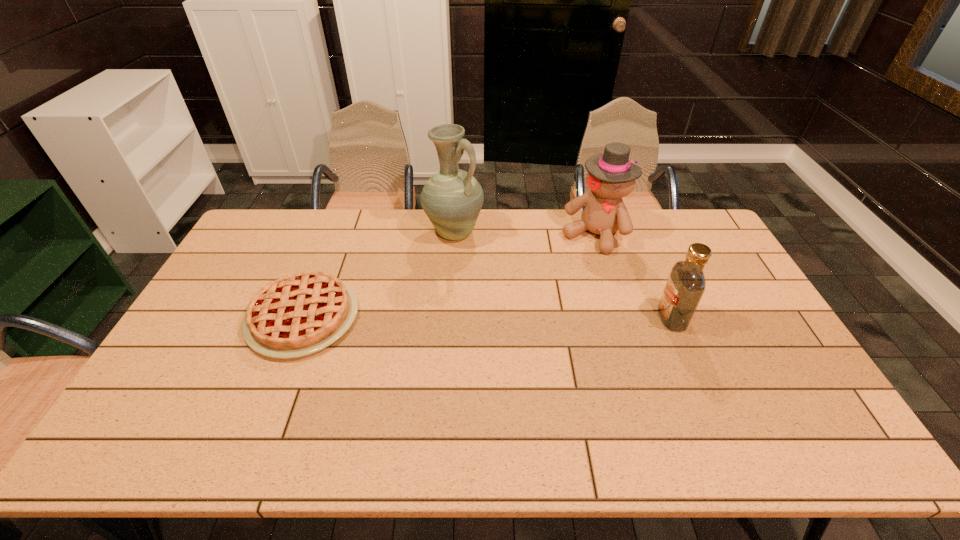
The height and width of the screenshot is (540, 960). I want to click on vacant area that lies between the second object from right to left and the tallest object, so click(x=524, y=234).

At what (x,y) coordinates should I click in order to perform the action: click on unoccupied position between the third tallest object and the shortest object. Please return your answer as a coordinate pair (x, y). The height and width of the screenshot is (540, 960). Looking at the image, I should click on (488, 317).

Where is `free space between the pie and the rag_doll`? This screenshot has height=540, width=960. free space between the pie and the rag_doll is located at coordinates (448, 276).

Where is `unoccupied area between the vodka and the rag_doll`? The height and width of the screenshot is (540, 960). unoccupied area between the vodka and the rag_doll is located at coordinates (633, 276).

At what (x,y) coordinates should I click in order to perform the action: click on vacant point located between the second tallest object and the second object from left to right. Please return your answer as a coordinate pair (x, y). Looking at the image, I should click on (524, 234).

Locate an element on the screen. The height and width of the screenshot is (540, 960). free space between the third object from right to left and the pie is located at coordinates [x=378, y=275].

You are a GUI agent. You are given a task and a screenshot of the screen. Output one action in this format:
    pyautogui.click(x=<x>, y=<y>)
    Task: Click on the vacant area between the rightmost object and the tallest object
    
    Given the screenshot: What is the action you would take?
    pyautogui.click(x=563, y=275)

Identify which object is located as the third nearest to the pitcher. Please provide its 2D coordinates. Your answer should be formatted as a tuple, i.e. [(x, y)], where the tuple contains the x and y coordinates of a point satisfying the conditions above.

[(686, 284)]

Choose which object is the nearest neighbor to the pitcher. Please provide its 2D coordinates. Your answer should be formatted as a tuple, i.e. [(x, y)], where the tuple contains the x and y coordinates of a point satisfying the conditions above.

[(302, 313)]

The height and width of the screenshot is (540, 960). What are the coordinates of `vacant region that satisfies the following two spatial constraints: 1. on the front side of the third tallest object; 2. on the front-facing side of the shortest object` in the screenshot? It's located at (302, 318).